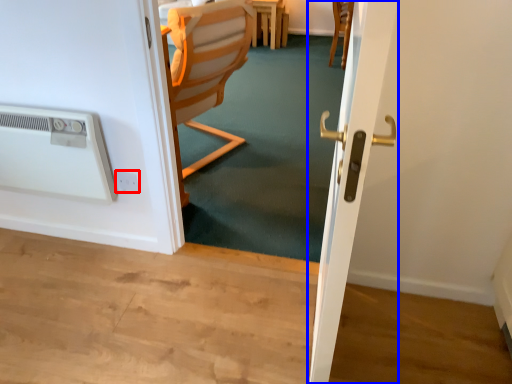
Question: Which object is closer to the camera taking this photo, electric outlet (highlighted by a red box) or screen door (highlighted by a blue box)?

Choices:
 (A) electric outlet
 (B) screen door

Answer: (B)